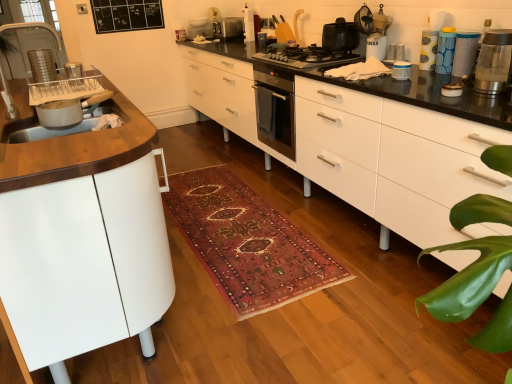
This screenshot has height=384, width=512. Find the location of `free space in front of white glossy container at upper right, the 6th appliance viewed from the top`. free space in front of white glossy container at upper right, the 6th appliance viewed from the top is located at coordinates (425, 76).